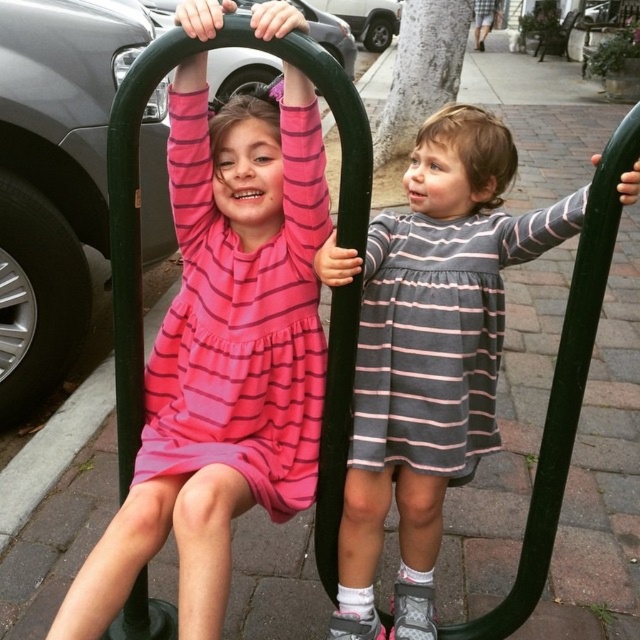
You are a photographer trying to capture both children in a single photo. The pink striped dress at upper left and the gray striped dress at center are the subjects. Given that the camera can only focus on objects wider than 30 cm, can both children be in focus?

The pink striped dress at upper left is narrower than the gray striped dress at center. Since the camera requires objects to be wider than 30 cm to focus, we need to confirm both widths. However, the description only states the pink is narrower than the gray, but doesn

You are a parent supervising the playground. You notice the pink striped dress at upper left and the gray striped dress at center. Which child is positioned higher up in the image?

The pink striped dress at upper left is located above the gray striped dress at center, so the child in the pink striped dress at upper left is positioned higher up in the image.

You are a parent watching your children play on the swing set. You notice the pink striped dress at upper left and the gray striped dress at center. How far apart are the two children wearing these dresses?

The pink striped dress at upper left and the gray striped dress at center are 10.97 inches apart.